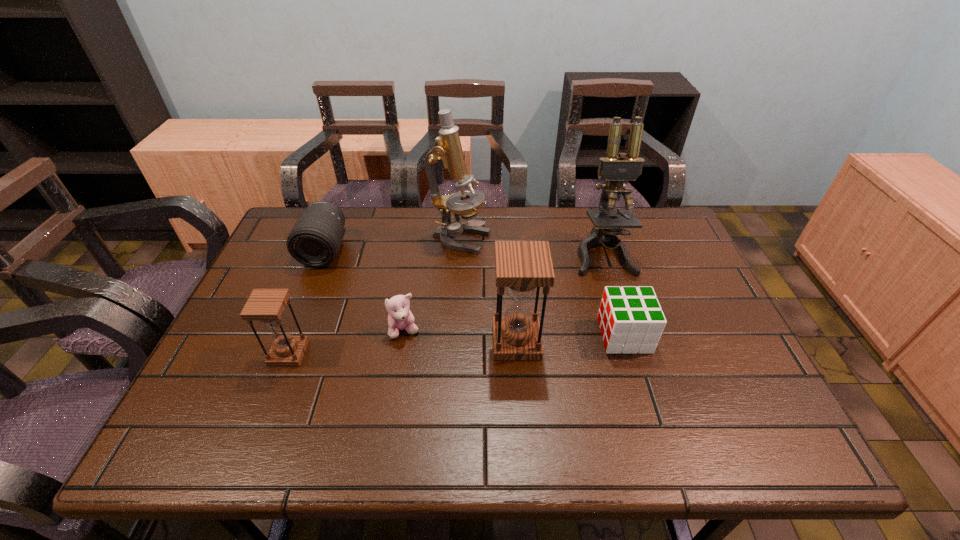
Identify the location of the shorter hourglass. (266, 305).

At what (x,y) coordinates should I click in order to perform the action: click on the left hourglass. Please return your answer as a coordinate pair (x, y). Looking at the image, I should click on (266, 305).

Where is `the third tallest object`? The image size is (960, 540). the third tallest object is located at coordinates (521, 267).

Locate an element on the screen. This screenshot has height=540, width=960. the right hourglass is located at coordinates (521, 267).

Locate an element on the screen. The width and height of the screenshot is (960, 540). telephoto lens is located at coordinates (314, 241).

What are the coordinates of `the right microscope` in the screenshot? It's located at (615, 168).

I want to click on the left microscope, so click(447, 151).

This screenshot has height=540, width=960. In order to click on cube in this screenshot , I will do `click(630, 318)`.

Locate an element on the screen. This screenshot has height=540, width=960. teddy bear is located at coordinates (400, 317).

The height and width of the screenshot is (540, 960). I want to click on vacant region located 0.320m on the back of the fourth tallest object, so click(326, 257).